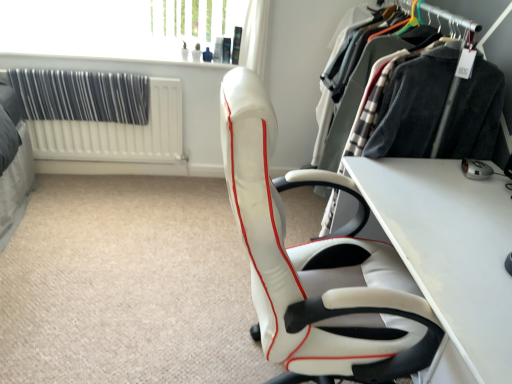
Where is `white glossy table at center`? This screenshot has width=512, height=384. white glossy table at center is located at coordinates (450, 249).

The height and width of the screenshot is (384, 512). What do you see at coordinates (125, 27) in the screenshot?
I see `transparent glass window screen at upper center` at bounding box center [125, 27].

Where is `white leather chair at center`? This screenshot has width=512, height=384. white leather chair at center is located at coordinates (317, 266).

Image resolution: width=512 pixels, height=384 pixels. What do you see at coordinates (317, 266) in the screenshot?
I see `white leather chair at center` at bounding box center [317, 266].

This screenshot has height=384, width=512. What are the coordinates of `white glossy table at center` in the screenshot? It's located at pyautogui.click(x=450, y=249).

Is white leather chair at center not close to white textured radiator at left?

white leather chair at center is far away from white textured radiator at left.

From a real-world perspective, is white leather chair at center under white textured radiator at left?

Incorrect, from a real-world perspective, white leather chair at center is higher than white textured radiator at left.

Between white leather chair at center and white textured radiator at left, which one appears on the left side from the viewer's perspective?

Positioned to the left is white textured radiator at left.

Looking at this image, from the image's perspective, is white leather chair at center above or below white textured radiator at left?

Based on their image positions, white leather chair at center is located beneath white textured radiator at left.

Would you say transparent glass window screen at upper center is inside or outside white glossy table at center?

transparent glass window screen at upper center lies outside white glossy table at center.

What's the angular difference between transparent glass window screen at upper center and white glossy table at center's facing directions?

The angular difference between transparent glass window screen at upper center and white glossy table at center is 90 degrees.

From the image's perspective, which is below, transparent glass window screen at upper center or white glossy table at center?

white glossy table at center is shown below in the image.

How distant is transparent glass window screen at upper center from white glossy table at center?

A distance of 1.52 meters exists between transparent glass window screen at upper center and white glossy table at center.

From a real-world perspective, between transparent glass window screen at upper center and white textured radiator at left, who is vertically higher?

In real-world perspective, transparent glass window screen at upper center is above.

Considering the relative positions of transparent glass window screen at upper center and white textured radiator at left in the image provided, is transparent glass window screen at upper center to the right of white textured radiator at left from the viewer's perspective?

Correct, you'll find transparent glass window screen at upper center to the right of white textured radiator at left.

Based on their sizes in the image, would you say transparent glass window screen at upper center is bigger or smaller than white textured radiator at left?

transparent glass window screen at upper center is bigger than white textured radiator at left.

Between transparent glass window screen at upper center and white textured radiator at left, which one is positioned behind?

white textured radiator at left.

Consider the image. Is white glossy table at center taller than transparent glass window screen at upper center?

Indeed, white glossy table at center has a greater height compared to transparent glass window screen at upper center.

Which is correct: white glossy table at center is inside transparent glass window screen at upper center, or outside of it?

white glossy table at center is spatially situated outside transparent glass window screen at upper center.

Which is nearer, (464, 334) or (34, 20)?

Point (464, 334) is positioned closer to the camera compared to point (34, 20).

Who is bigger, velvet black coat at right or white textured radiator at left?

With larger size is velvet black coat at right.

Is point (378, 228) closer or farther from the camera than point (137, 153)?

Point (378, 228) appears to be closer to the viewer than point (137, 153).

From a real-world perspective, which is physically above, velvet black coat at right or white textured radiator at left?

In real-world perspective, velvet black coat at right is above.

From the image's perspective, would you say transparent glass window screen at upper center is shown under silver metallic mouse at lower right?

No, from the image's perspective, transparent glass window screen at upper center is not below silver metallic mouse at lower right.

Between transparent glass window screen at upper center and silver metallic mouse at lower right, which one appears on the right side from the viewer's perspective?

Positioned to the right is silver metallic mouse at lower right.

From a real-world perspective, which object stands above the other?

From a 3D spatial view, transparent glass window screen at upper center is above.

Is white textured radiator at left far from silver metallic mouse at lower right?

white textured radiator at left is far away from silver metallic mouse at lower right.

Is point (35, 142) less distant than point (470, 172)?

No, it is not.

Considering the relative sizes of white textured radiator at left and silver metallic mouse at lower right in the image provided, is white textured radiator at left smaller than silver metallic mouse at lower right?

No, white textured radiator at left is not smaller than silver metallic mouse at lower right.

Where is `chair below the white textured radiator at left (from the image's perspective)`? chair below the white textured radiator at left (from the image's perspective) is located at coordinates point(317,266).

At what (x,y) coordinates should I click in order to perform the action: click on table that appears on the right of transparent glass window screen at upper center. Please return your answer as a coordinate pair (x, y). The height and width of the screenshot is (384, 512). Looking at the image, I should click on (450, 249).

From the image, which object appears to be farther from white glossy table at center, black fabric curtain at upper left or silver metallic mouse at lower right?

Based on the image, black fabric curtain at upper left appears to be further to white glossy table at center.

Which object lies further to the anchor point white glossy table at center, white textured radiator at left or velvet black coat at right?

The object further to white glossy table at center is white textured radiator at left.

Looking at the image, which one is located closer to black fabric curtain at upper left, white textured radiator at left or white glossy table at center?

Among the two, white textured radiator at left is located nearer to black fabric curtain at upper left.

Considering their positions, is silver metallic mouse at lower right positioned further to white leather chair at center than white textured radiator at left?

white textured radiator at left is further to white leather chair at center.

Looking at the image, which one is located closer to transparent glass window screen at upper center, black fabric curtain at upper left or white textured radiator at left?

Among the two, black fabric curtain at upper left is located nearer to transparent glass window screen at upper center.

Which object lies further to the anchor point white leather chair at center, black fabric curtain at upper left or white glossy table at center?

Based on the image, black fabric curtain at upper left appears to be further to white leather chair at center.

Looking at the image, which one is located further to transparent glass window screen at upper center, white textured radiator at left or white leather chair at center?

white leather chair at center is positioned further to the anchor transparent glass window screen at upper center.

Based on their spatial positions, is velvet black coat at right or white glossy table at center closer to white leather chair at center?

white glossy table at center is closer to white leather chair at center.

Identify the location of closet between black fabric curtain at upper left and silver metallic mouse at lower right from left to right. The height and width of the screenshot is (384, 512). (505, 80).

At what (x,y) coordinates should I click in order to perform the action: click on table between white leather chair at center and white textured radiator at left along the z-axis. Please return your answer as a coordinate pair (x, y). Looking at the image, I should click on (450, 249).

Where is `closet between white leather chair at center and white textured radiator at left along the z-axis`? This screenshot has height=384, width=512. closet between white leather chair at center and white textured radiator at left along the z-axis is located at coordinates (505, 80).

The height and width of the screenshot is (384, 512). Find the location of `table between white leather chair at center and black fabric curtain at upper left from front to back`. table between white leather chair at center and black fabric curtain at upper left from front to back is located at coordinates (450, 249).